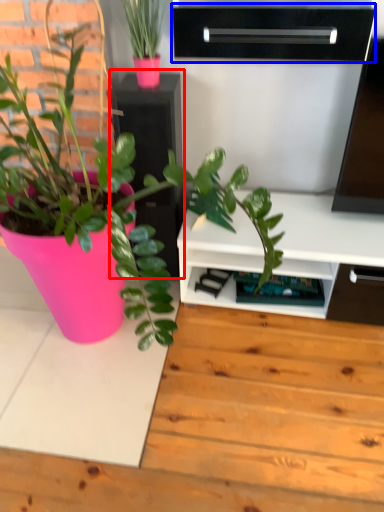
Question: Which object appears closest to the camera in this image, file cabinet (highlighted by a red box) or shelf (highlighted by a blue box)?

Choices:
 (A) file cabinet
 (B) shelf

Answer: (B)